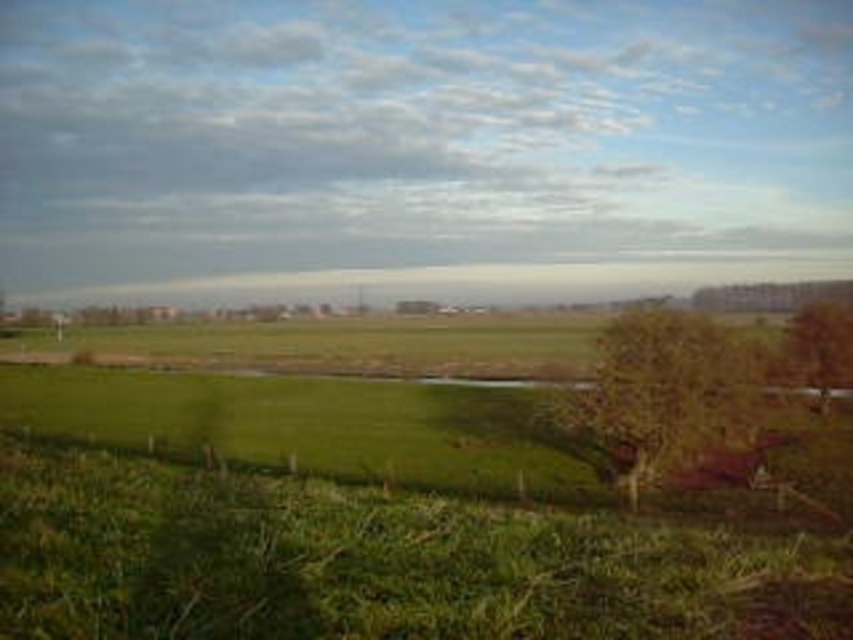
Question: Is brown textured tree at center right to the right of brown textured tree at right from the viewer's perspective?

Choices:
 (A) no
 (B) yes

Answer: (A)

Question: Observing the image, what is the correct spatial positioning of brown textured tree at center right in reference to brown textured tree at right?

Choices:
 (A) left
 (B) right

Answer: (A)

Question: Among these points, which one is farthest from the camera?

Choices:
 (A) (804, 321)
 (B) (698, 348)

Answer: (A)

Question: Observing the image, what is the correct spatial positioning of brown textured tree at center right in reference to brown textured tree at right?

Choices:
 (A) right
 (B) left

Answer: (B)